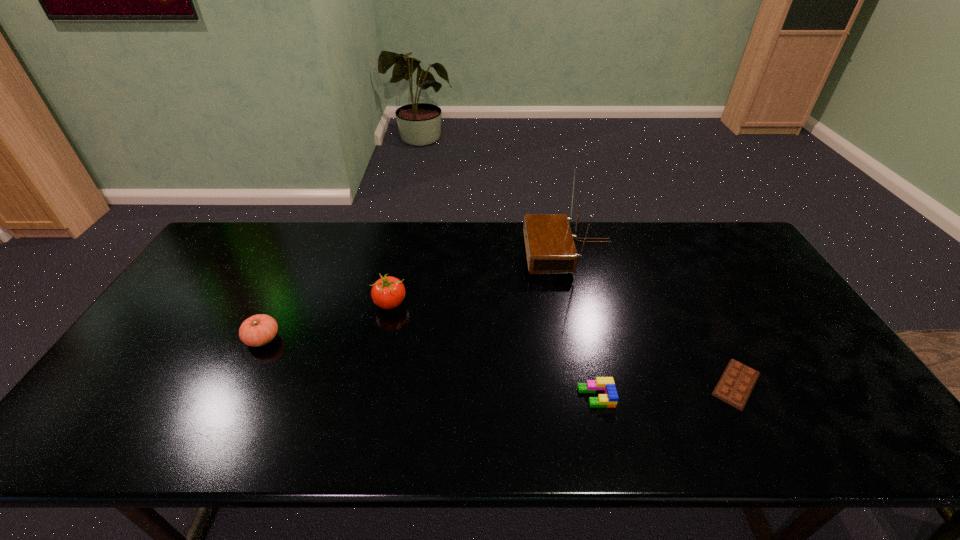
Where is `the tallest object`? Image resolution: width=960 pixels, height=540 pixels. the tallest object is located at coordinates (550, 248).

Identify the location of the farthest object. The height and width of the screenshot is (540, 960). (550, 248).

In order to click on the fourth object from right to left in this screenshot , I will do `click(388, 292)`.

At what (x,y) coordinates should I click in order to perform the action: click on the second tallest object. Please return your answer as a coordinate pair (x, y). This screenshot has width=960, height=540. Looking at the image, I should click on 388,292.

I want to click on the third farthest object, so click(x=258, y=330).

Where is `the shorter tomato`? Image resolution: width=960 pixels, height=540 pixels. the shorter tomato is located at coordinates point(258,330).

At what (x,y) coordinates should I click in order to perform the action: click on Lego. Please return your answer as a coordinate pair (x, y). This screenshot has height=540, width=960. Looking at the image, I should click on (606, 385).

This screenshot has width=960, height=540. In order to click on chocolate bar in this screenshot , I will do `click(738, 380)`.

Where is `the rightmost object`? The height and width of the screenshot is (540, 960). the rightmost object is located at coordinates (738, 380).

You are a GUI agent. You are given a task and a screenshot of the screen. Output one action in this format:
    pyautogui.click(x=<x>, y=<y>)
    Task: Click on the free space located on the front panel of the farthest object
    
    Given the screenshot: What is the action you would take?
    pyautogui.click(x=451, y=252)